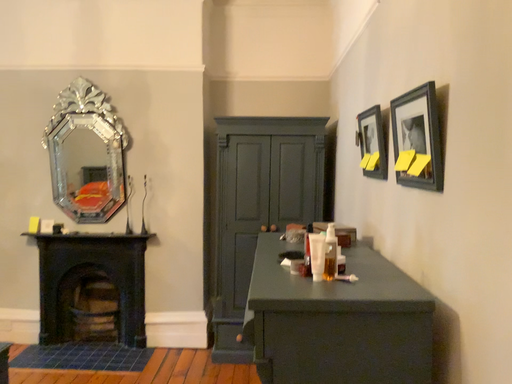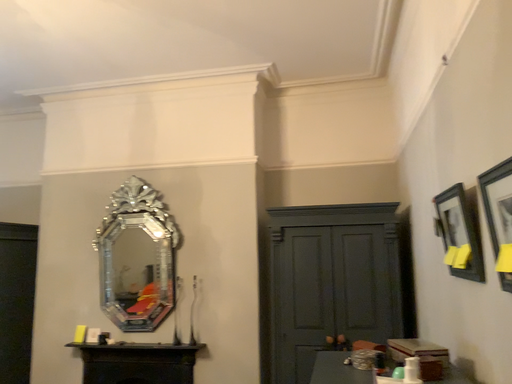
Question: How did the camera likely rotate when shooting the video?

Choices:
 (A) rotated left
 (B) rotated right

Answer: (A)